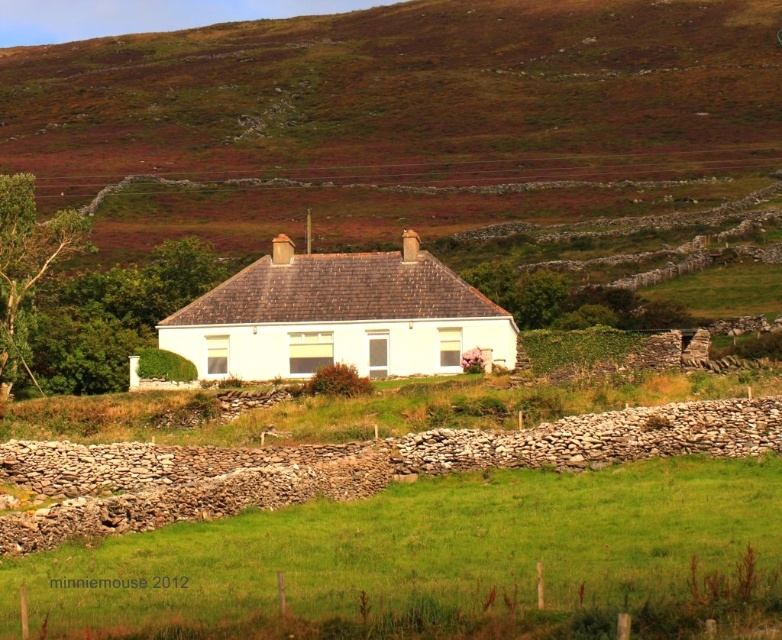
Question: Which of the following is the farthest from the observer?

Choices:
 (A) (199, 369)
 (B) (371, 504)
 (C) (187, 442)

Answer: (A)

Question: Which point is closer to the camera?

Choices:
 (A) green grass at center
 (B) green grassy at center

Answer: (A)

Question: Where is green grass at center located in relation to white smooth house at center in the image?

Choices:
 (A) left
 (B) right

Answer: (B)

Question: Is green grass at center wider than white smooth house at center?

Choices:
 (A) yes
 (B) no

Answer: (A)

Question: Which of the following is the closest to the observer?

Choices:
 (A) (761, 461)
 (B) (232, 428)

Answer: (A)

Question: Can you confirm if green grass at center is positioned below white smooth house at center?

Choices:
 (A) yes
 (B) no

Answer: (A)